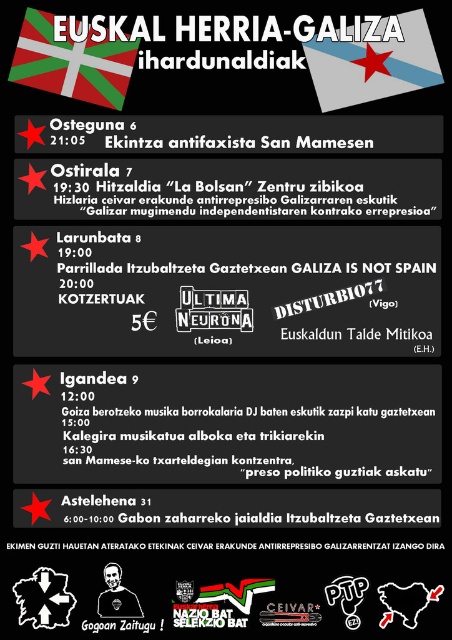
You are looking at the promotional poster for the Basque Country and Galicia solidarity meetings. The poster has a dark background with flags and event details. There is a point marked at coordinates (373,65). Which flag is this point located on?

The point at (373,65) is on the blue fabric flag at upper center, which is the Galician flag with a red star on a blue background.

You are an event organizer arranging decorations for the poster. You need to determine if the black paper at center will fit under the blue fabric flag at upper center. Can it fit vertically?

The black paper at center has a lesser height compared to the blue fabric flag at upper center, so it will fit vertically under the flag since it is shorter.

You are designing a poster and need to place a white fabric flag at upper left and a black paper at center. Given their sizes, which object will occupy more space on the poster?

The black paper at center is bigger than the white fabric flag at upper left, so it will occupy more space on the poster.